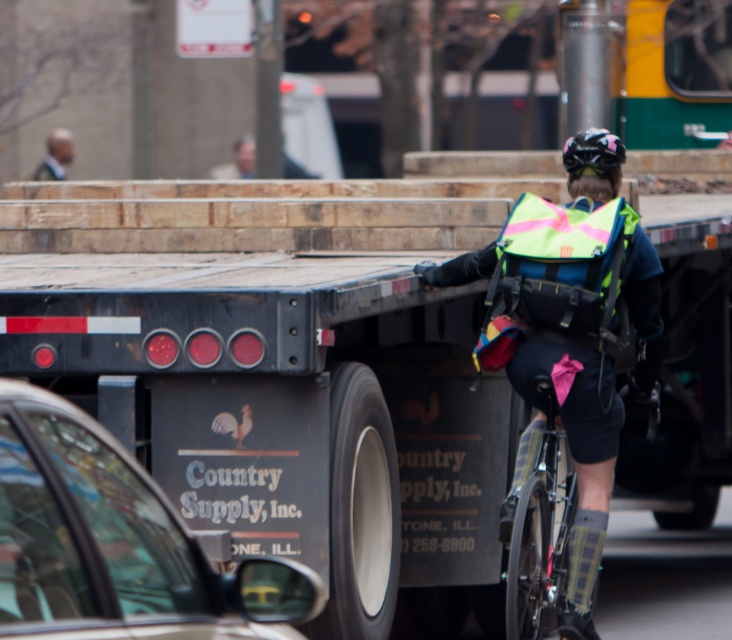
Is black matte truck at lower left smaller than shiny black frame at center?

Incorrect, black matte truck at lower left is not smaller in size than shiny black frame at center.

Locate an element on the screen. black matte truck at lower left is located at coordinates (113, 541).

Is shiny black helmet at upper center to the left of light brown hair at upper left from the viewer's perspective?

No, shiny black helmet at upper center is not to the left of light brown hair at upper left.

Is shiny black helmet at upper center bigger than light brown hair at upper left?

No, shiny black helmet at upper center is not bigger than light brown hair at upper left.

Identify the location of shiny black helmet at upper center. (593, 150).

Between black matte truck at lower left and neon reflective vest at center, which one has less height?

Standing shorter between the two is black matte truck at lower left.

Image resolution: width=732 pixels, height=640 pixels. What are the coordinates of `black matte truck at lower left` in the screenshot? It's located at (113, 541).

Which is behind, point (135, 486) or point (507, 529)?

Positioned behind is point (507, 529).

You are a GUI agent. You are given a task and a screenshot of the screen. Output one action in this format:
    pyautogui.click(x=<x>, y=<y>)
    Task: Click on the black matte truck at lower left
    
    Given the screenshot: What is the action you would take?
    pyautogui.click(x=113, y=541)